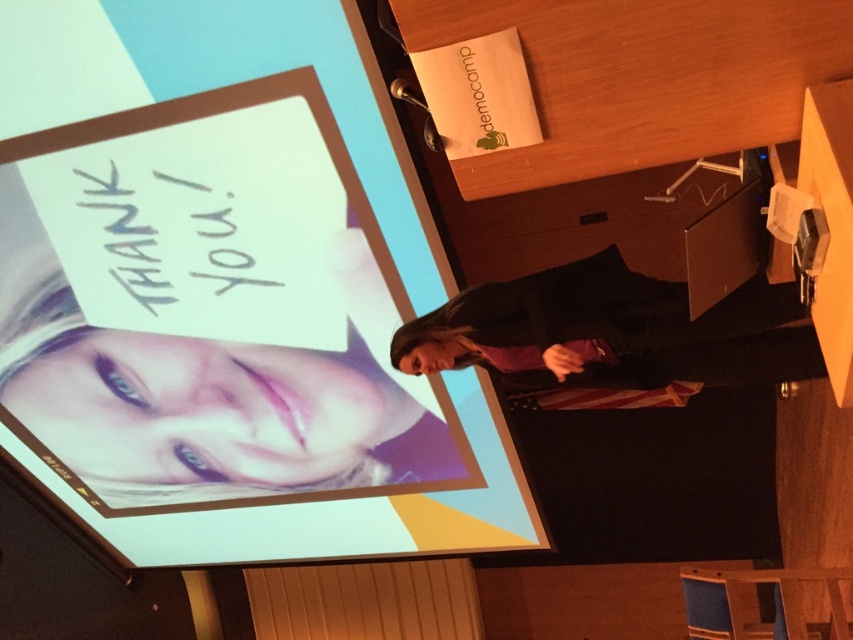
Question: Can you confirm if matte plastic projection screen at center is bigger than black fabric at center?

Choices:
 (A) yes
 (B) no

Answer: (A)

Question: Can you confirm if smooth skin face at center is smaller than black fabric at center?

Choices:
 (A) no
 (B) yes

Answer: (A)

Question: Is matte plastic projection screen at center smaller than smooth skin face at center?

Choices:
 (A) no
 (B) yes

Answer: (A)

Question: Among these points, which one is nearest to the camera?

Choices:
 (A) (465, 550)
 (B) (335, 394)
 (C) (753, 332)

Answer: (C)

Question: Among these points, which one is farthest from the camera?

Choices:
 (A) (155, 10)
 (B) (583, 321)
 (C) (158, 499)

Answer: (C)

Question: Which of these objects is positioned farthest from the black fabric at center?

Choices:
 (A) smooth skin face at center
 (B) matte plastic projection screen at center

Answer: (A)